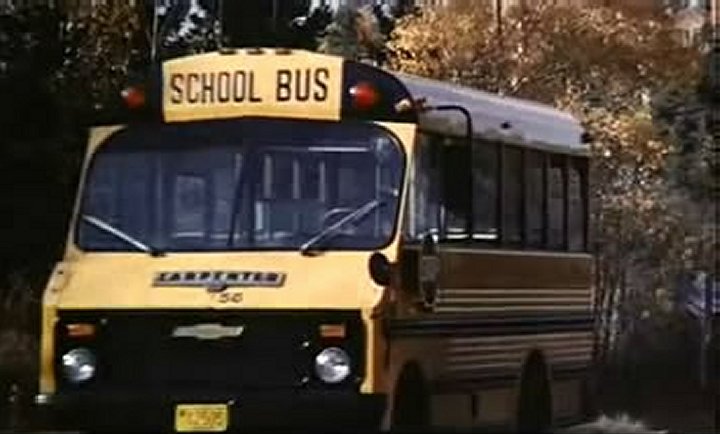
Find the location of a particular element. Image resolution: width=720 pixels, height=434 pixels. red lights is located at coordinates (354, 86), (127, 89).